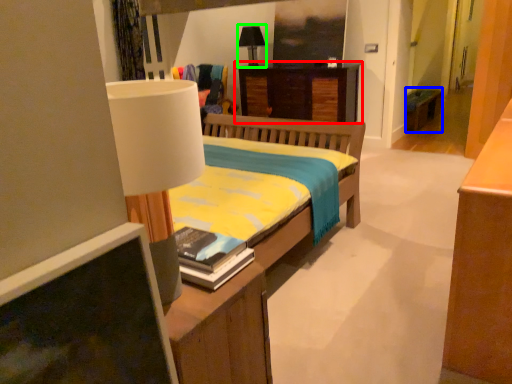
Question: Estimate the real-world distances between objects in this image. Which object is closer to desk (highlighted by a red box), table (highlighted by a blue box) or table lamp (highlighted by a green box)?

Choices:
 (A) table
 (B) table lamp

Answer: (B)